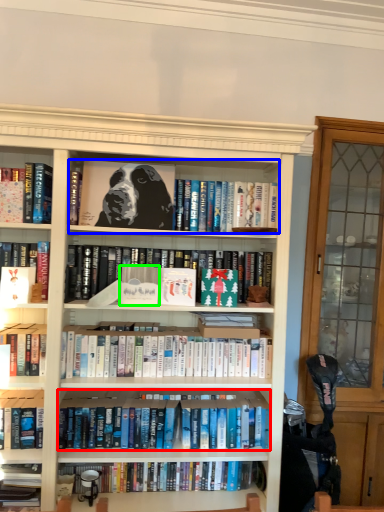
Question: Considering the real-world distances, which object is farthest from book (highlighted by a red box)? book (highlighted by a blue box) or paperback book (highlighted by a green box)?

Choices:
 (A) book
 (B) paperback book

Answer: (A)